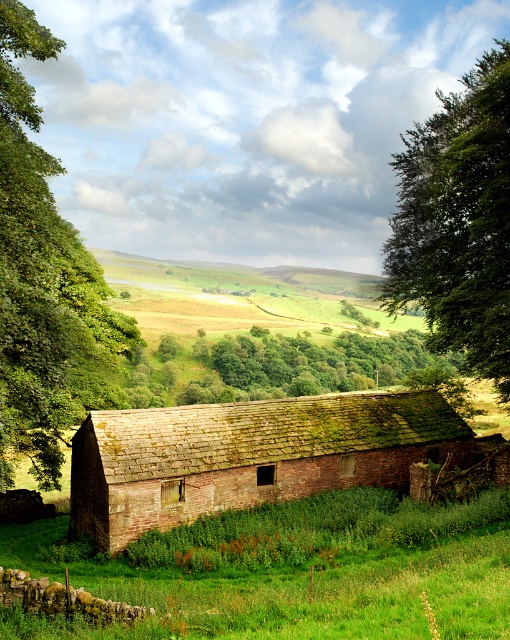
Can you confirm if green grassy at lower center is positioned above brown brick barn at center?

No.

How much distance is there between green grassy at lower center and brown brick barn at center?

19.04 feet

Who is more distant from viewer, (170, 600) or (184, 472)?

The point (184, 472) is more distant.

The height and width of the screenshot is (640, 510). Find the location of `green grassy at lower center`. green grassy at lower center is located at coordinates click(x=314, y=573).

How distant is brown brick barn at center from green leafy tree at upper right?

brown brick barn at center and green leafy tree at upper right are 13.28 meters apart from each other.

Which is more to the left, brown brick barn at center or green leafy tree at upper right?

Positioned to the left is brown brick barn at center.

Is point (249, 502) more distant than point (503, 244)?

Yes, it is.

The height and width of the screenshot is (640, 510). I want to click on brown brick barn at center, so 247,456.

Is brown brick barn at center below green leafy tree at left?

Yes.

Locate an element on the screen. Image resolution: width=510 pixels, height=640 pixels. brown brick barn at center is located at coordinates (247, 456).